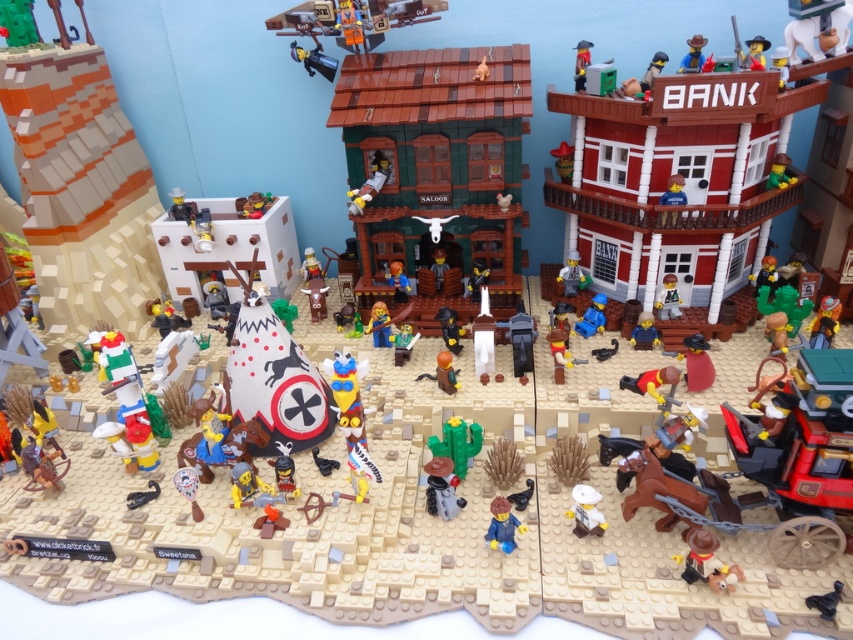
Question: Is matte yellow figure at center to the right of white plastic figure at lower center from the viewer's perspective?

Choices:
 (A) yes
 (B) no

Answer: (B)

Question: Is green matte cactus at center bigger than matte black gun at center?

Choices:
 (A) no
 (B) yes

Answer: (B)

Question: Which object appears farthest from the camera in this image?

Choices:
 (A) smooth yellow cowboy hat at center
 (B) matte red cowboy hat at center
 (C) blue plastic car at center-right

Answer: (C)

Question: Is matte yellow figure at center behind smooth red cowboy hat at upper center?

Choices:
 (A) yes
 (B) no

Answer: (B)

Question: Considering the real-world distances, which object is closest to the matte black gun at center?

Choices:
 (A) smooth red brick bank at upper right
 (B) white plastic figure at lower center
 (C) brick red wagon at lower right
 (D) green matte shield at center

Answer: (B)

Question: Among these points, which one is nearest to the camera?

Choices:
 (A) 659,378
 (B) 672,301
 (C) 376,301
 (D) 686,340

Answer: (A)